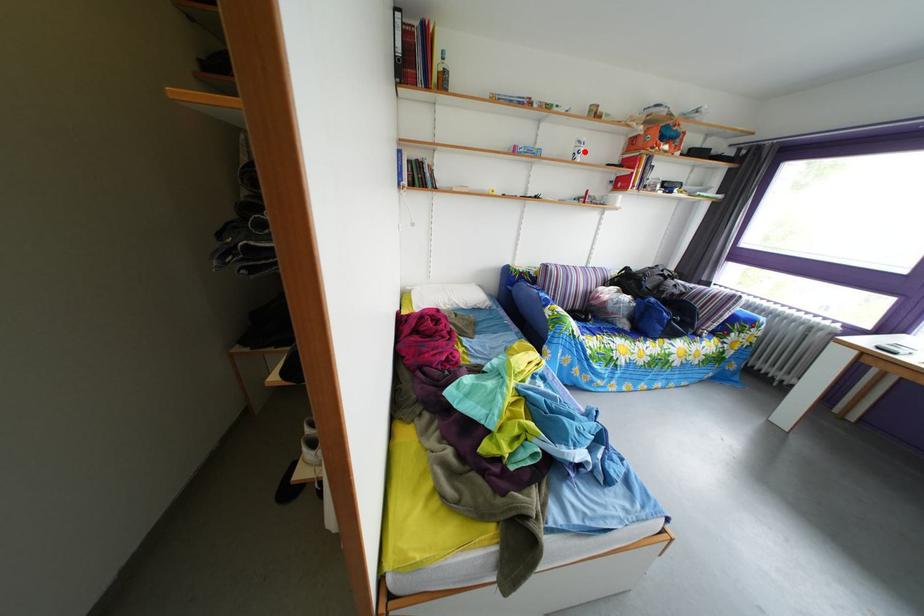
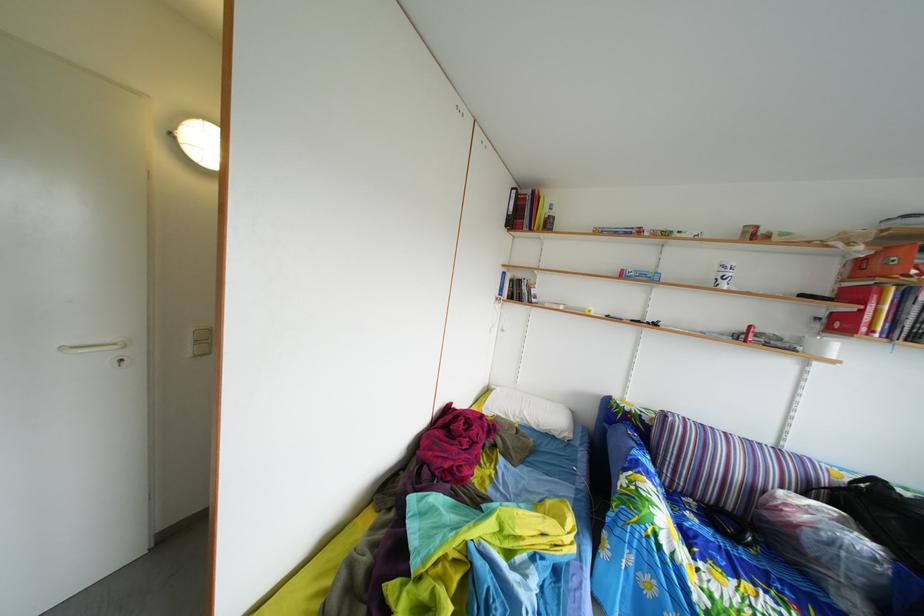
Locate, in the second image, the point that corresponds to the highlighted location in the first image.

(727, 276)